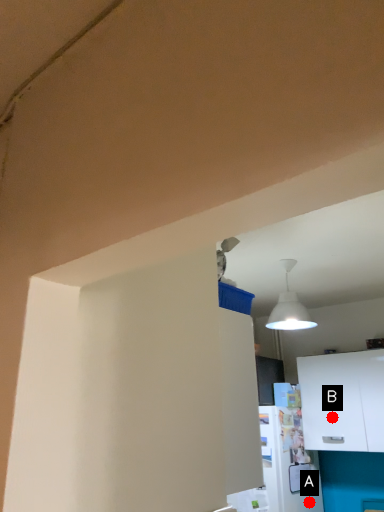
Question: Two points are circled on the image, labeled by A and B beside each circle. Which point is further to the camera?

Choices:
 (A) A is further
 (B) B is further

Answer: (A)